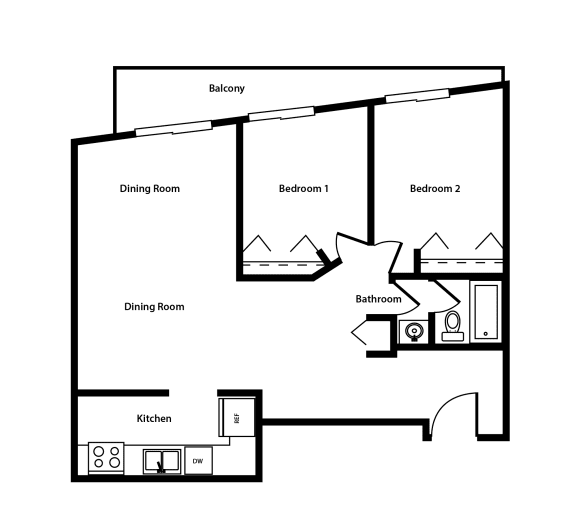
You are a GUI agent. You are given a task and a screenshot of the screen. Output one action in this format:
    pyautogui.click(x=<x>, y=<y>)
    Task: Click on the sink
    The height and width of the screenshot is (518, 576).
    Given the screenshot: What is the action you would take?
    pyautogui.click(x=151, y=456)